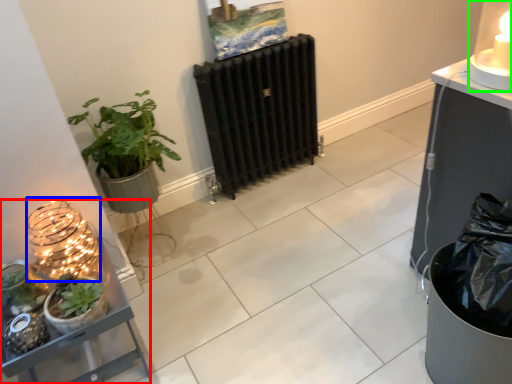
Question: Which is farther away from shelf (highlighted by a red box)? candle holder (highlighted by a blue box) or candle holder (highlighted by a green box)?

Choices:
 (A) candle holder
 (B) candle holder

Answer: (B)